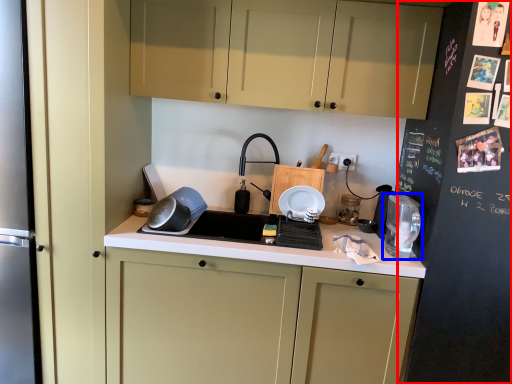
Question: Which object is further to the camera taking this photo, bulletin board (highlighted by a red box) or home appliance (highlighted by a blue box)?

Choices:
 (A) bulletin board
 (B) home appliance

Answer: (B)